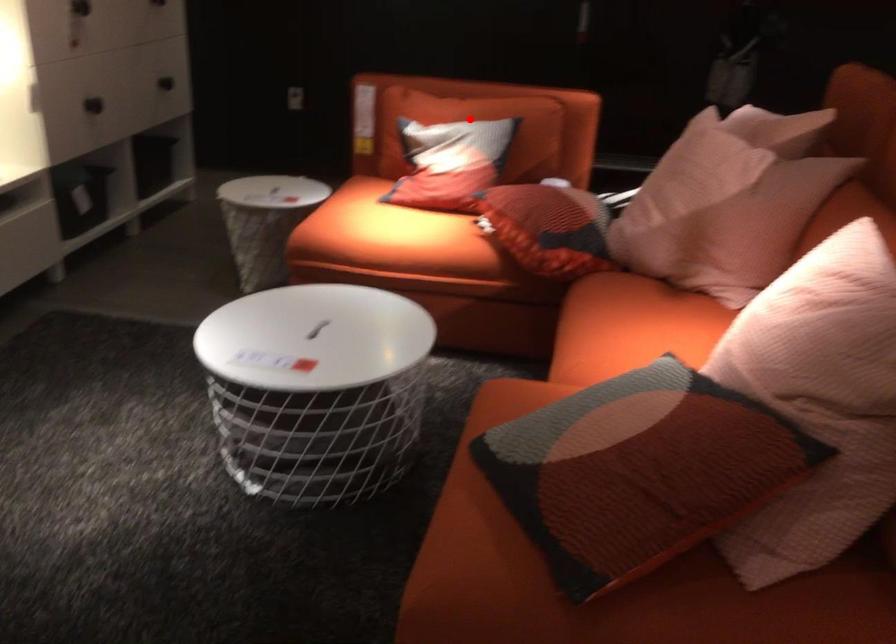
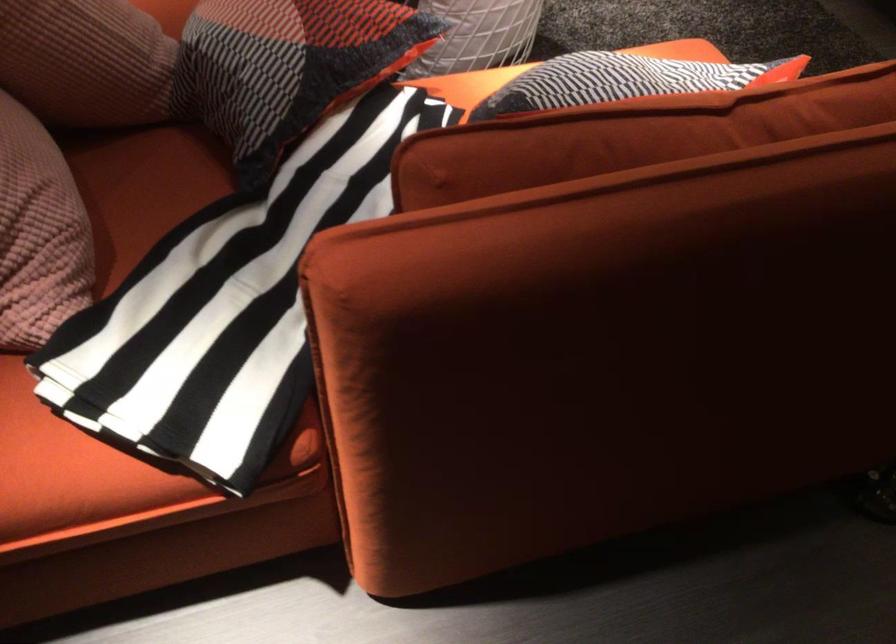
In the second image, find the point that corresponds to the highlighted location in the first image.

(623, 80)